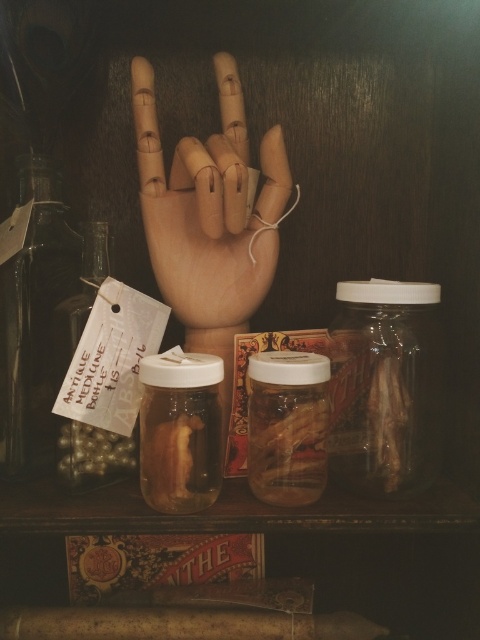
You are an archaeologist examining the dark wooden shelf. You notice two points marked on the shelf. Which point is closer to you, point (24, 243) or point (86, 465)?

Point (86, 465) is closer to you because point (24, 243) is behind it.

You are a visitor in a mysterious antique shop and see the wooden hand at center and the transparent glass bottle at left. Which object is closer to you?

The wooden hand at center is closer to you because it is positioned over the transparent glass bottle at left, indicating it is in front of it.